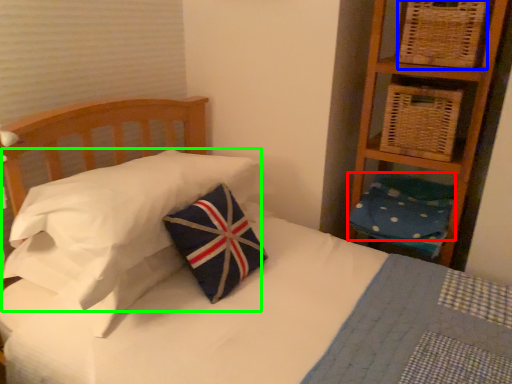
Question: Which object is positioned farthest from pillow (highlighted by a red box)? Select from basket (highlighted by a blue box) and pillow (highlighted by a green box).

Choices:
 (A) basket
 (B) pillow

Answer: (B)